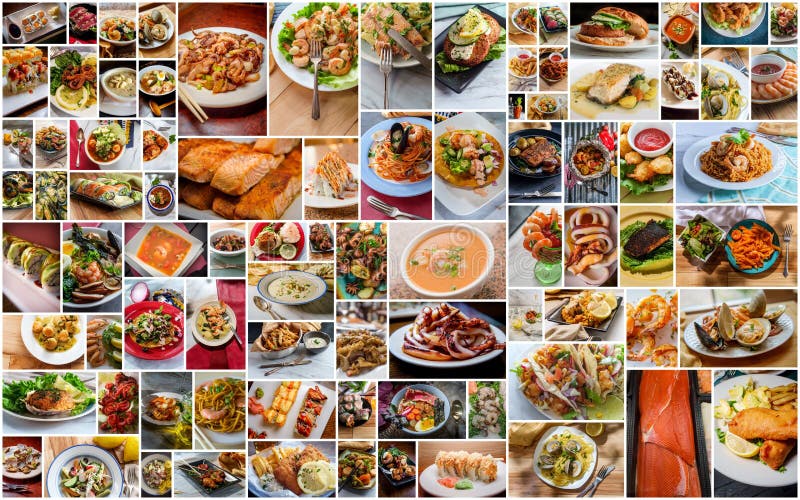
Locate an element on the screen. Image resolution: width=800 pixels, height=500 pixels. pictures in the corner of the collage is located at coordinates (742, 463), (29, 472), (38, 30), (785, 20).